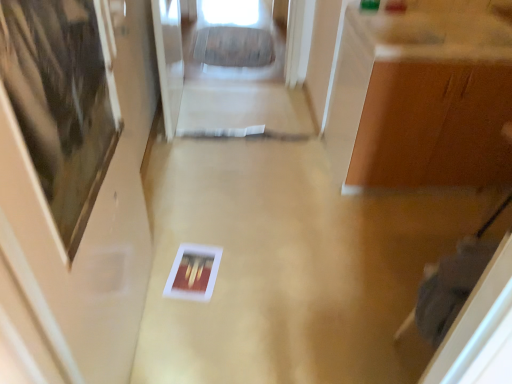
Where is `vacant space to the right of matte wood door at left`? This screenshot has height=384, width=512. vacant space to the right of matte wood door at left is located at coordinates (244, 326).